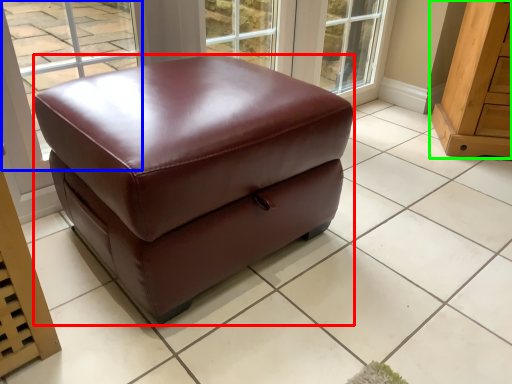
Question: Based on their relative distances, which object is farther from furniture (highlighted by a red box)? Choose from window (highlighted by a blue box) and furniture (highlighted by a green box).

Choices:
 (A) window
 (B) furniture

Answer: (A)